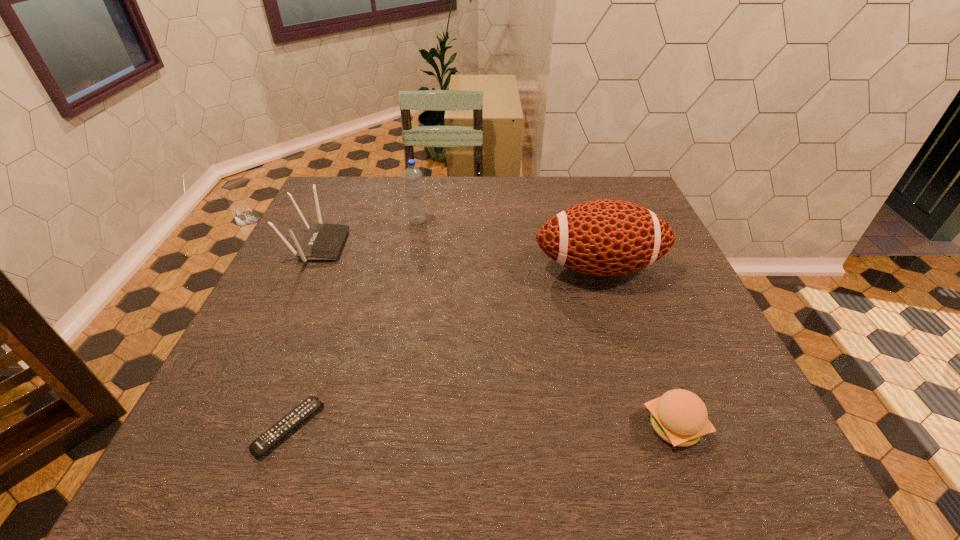
Locate an element on the screen. This screenshot has height=540, width=960. free point between the remote control and the router is located at coordinates (303, 336).

The height and width of the screenshot is (540, 960). In order to click on free space between the remote control and the hamburger in this screenshot , I will do `click(482, 427)`.

Where is `vacant area that lies between the football and the remote control`? The height and width of the screenshot is (540, 960). vacant area that lies between the football and the remote control is located at coordinates (444, 347).

Where is `free spot between the water bottle and the third tallest object`? free spot between the water bottle and the third tallest object is located at coordinates (368, 233).

What are the coordinates of `vacant space that's between the water bottle and the hamburger` in the screenshot? It's located at (546, 323).

Choose which object is the second nearest neighbor to the second shortest object. Please provide its 2D coordinates. Your answer should be formatted as a tuple, i.e. [(x, y)], where the tuple contains the x and y coordinates of a point satisfying the conditions above.

[(289, 422)]

Point out which object is positioned as the second nearest to the router. Please provide its 2D coordinates. Your answer should be formatted as a tuple, i.e. [(x, y)], where the tuple contains the x and y coordinates of a point satisfying the conditions above.

[(289, 422)]

The width and height of the screenshot is (960, 540). Identify the location of free point that satisfies the following two spatial constraints: 1. on the front side of the water bottle; 2. on the left side of the football. (409, 268).

Locate an element on the screen. blank space that satisfies the following two spatial constraints: 1. on the front-facing side of the hamburger; 2. on the left side of the third tallest object is located at coordinates (234, 426).